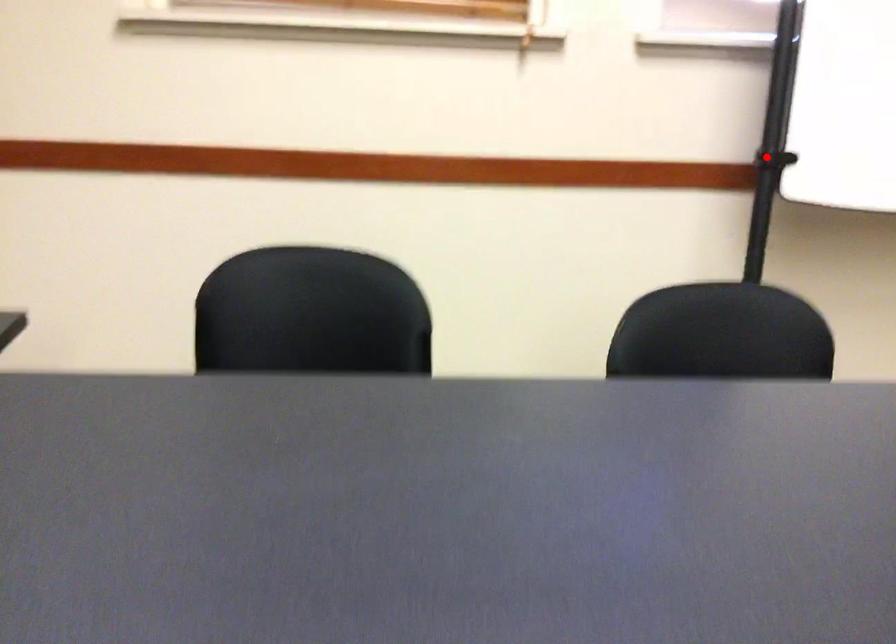
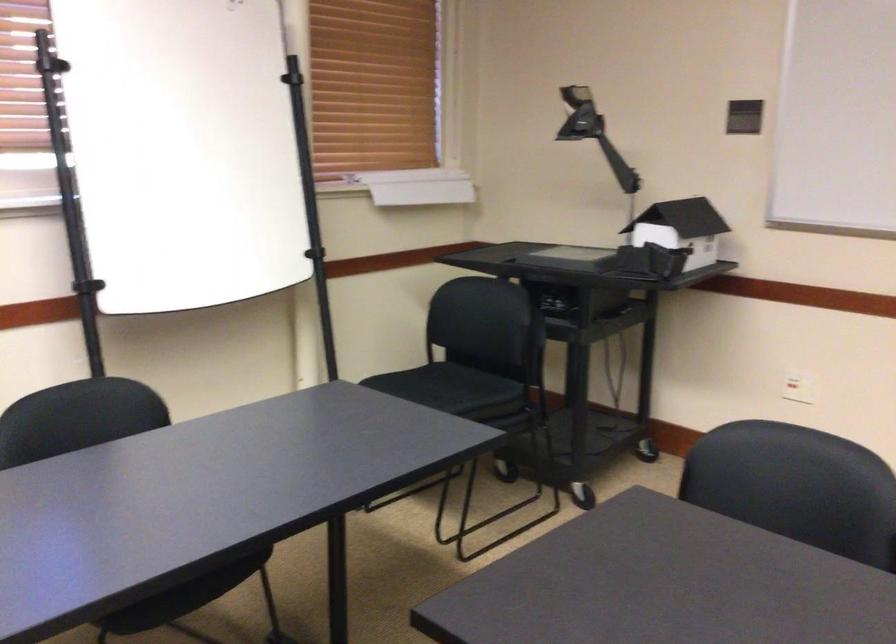
Find the pixel in the second image that matches the highlighted location in the first image.

(88, 285)